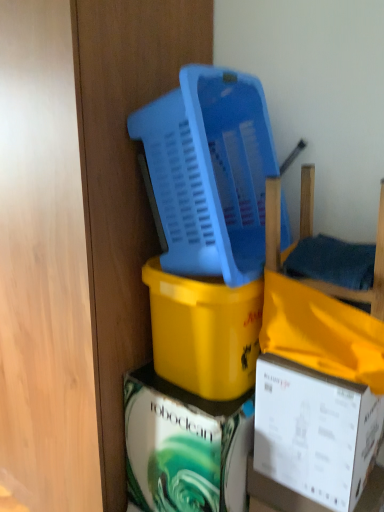
This screenshot has width=384, height=512. What do you see at coordinates (184, 447) in the screenshot?
I see `matte white box at center, positioned as the 3th box in top-to-bottom order` at bounding box center [184, 447].

Locate an element on the screen. This screenshot has width=384, height=512. blue plastic basket at upper center is located at coordinates (210, 172).

This screenshot has width=384, height=512. Identify the location of white cardboard box at lower right, which is the second box from top to bottom. point(315,433).

Is white cardboard box at lower right, which is the second box from top to bottom, surrounding yellow matte plastic bucket at center, which ranks as the first box in top-to-bottom order?

That's incorrect, yellow matte plastic bucket at center, which ranks as the first box in top-to-bottom order, is not inside white cardboard box at lower right, which is the second box from top to bottom.

Is white cardboard box at lower right, which is the second box from top to bottom, bigger or smaller than yellow matte plastic bucket at center, which ranks as the first box in top-to-bottom order?

In the image, white cardboard box at lower right, which is the second box from top to bottom, appears to be smaller than yellow matte plastic bucket at center, which ranks as the first box in top-to-bottom order.

Considering the relative positions of white cardboard box at lower right, which appears as the 2th box when ordered from the bottom, and yellow matte plastic bucket at center, which ranks as the first box in top-to-bottom order, in the image provided, is white cardboard box at lower right, which appears as the 2th box when ordered from the bottom, behind yellow matte plastic bucket at center, which ranks as the first box in top-to-bottom order,?

No, the depth of white cardboard box at lower right, which appears as the 2th box when ordered from the bottom, is less than that of yellow matte plastic bucket at center, which ranks as the first box in top-to-bottom order.

From a real-world perspective, is white cardboard box at lower right, which is the second box from top to bottom, above or below wooden chair at right?

white cardboard box at lower right, which is the second box from top to bottom, is situated lower than wooden chair at right in the real world.

The image size is (384, 512). Find the location of `furniture above the white cardboard box at lower right, which appears as the 2th box when ordered from the bottom (from the image's perspective)`. furniture above the white cardboard box at lower right, which appears as the 2th box when ordered from the bottom (from the image's perspective) is located at coordinates (374, 276).

Considering the relative positions of white cardboard box at lower right, which is the second box from top to bottom, and wooden chair at right in the image provided, is white cardboard box at lower right, which is the second box from top to bottom, to the left of wooden chair at right from the viewer's perspective?

Yes, white cardboard box at lower right, which is the second box from top to bottom, is to the left of wooden chair at right.

Measure the distance between white cardboard box at lower right, which is the second box from top to bottom, and wooden chair at right.

white cardboard box at lower right, which is the second box from top to bottom, and wooden chair at right are 13.93 inches apart.

From a real-world perspective, is white cardboard box at lower right, which appears as the 2th box when ordered from the bottom, located higher than blue plastic basket at upper center?

No.

Is white cardboard box at lower right, which appears as the 2th box when ordered from the bottom, located outside blue plastic basket at upper center?

That's correct, white cardboard box at lower right, which appears as the 2th box when ordered from the bottom, is outside of blue plastic basket at upper center.

Does white cardboard box at lower right, which appears as the 2th box when ordered from the bottom, have a greater width compared to blue plastic basket at upper center?

In fact, white cardboard box at lower right, which appears as the 2th box when ordered from the bottom, might be narrower than blue plastic basket at upper center.

Does point (319, 481) come farther from viewer compared to point (223, 71)?

No, it is in front of (223, 71).

Does wooden chair at right come behind blue plastic basket at upper center?

No.

Is wooden chair at right aimed at blue plastic basket at upper center?

No, wooden chair at right is not oriented towards blue plastic basket at upper center.

From the image's perspective, which is above, wooden chair at right or blue plastic basket at upper center?

blue plastic basket at upper center appears higher in the image.

From a real-world perspective, which object stands above the other?

From a 3D spatial view, blue plastic basket at upper center is above.

Does point (182, 312) come farther from viewer compared to point (380, 201)?

No, it is not.

From the image's perspective, between yellow matte plastic bucket at center, which ranks as the first box in top-to-bottom order, and wooden chair at right, which one is located above?

From the image's view, wooden chair at right is above.

Looking at this image, is yellow matte plastic bucket at center, which is counted as the 3th box, starting from the bottom, taller or shorter than wooden chair at right?

In the image, yellow matte plastic bucket at center, which is counted as the 3th box, starting from the bottom, appears to be taller than wooden chair at right.

Which object is thinner, yellow matte plastic bucket at center, which is counted as the 3th box, starting from the bottom, or wooden chair at right?

wooden chair at right is thinner.

At what (x,y) coordinates should I click in order to perform the action: click on the 2nd box behind the blue plastic basket at upper center, starting your count from the anchor. Please return your answer as a coordinate pair (x, y). Looking at the image, I should click on (204, 332).

Is yellow matte plastic bucket at center, which is counted as the 3th box, starting from the bottom, positioned far away from blue plastic basket at upper center?

No, yellow matte plastic bucket at center, which is counted as the 3th box, starting from the bottom, is in close proximity to blue plastic basket at upper center.

From the image's perspective, which is below, yellow matte plastic bucket at center, which is counted as the 3th box, starting from the bottom, or blue plastic basket at upper center?

yellow matte plastic bucket at center, which is counted as the 3th box, starting from the bottom, is shown below in the image.

Which object is wider, yellow matte plastic bucket at center, which is counted as the 3th box, starting from the bottom, or blue plastic basket at upper center?

blue plastic basket at upper center.

Does matte white box at center, positioned as the 3th box in top-to-bottom order, have a greater width compared to wooden chair at right?

Indeed, matte white box at center, positioned as the 3th box in top-to-bottom order, has a greater width compared to wooden chair at right.

From the image's perspective, is matte white box at center, positioned as the 3th box in top-to-bottom order, above wooden chair at right?

No.

Does matte white box at center, the 1th box when ordered from bottom to top, turn towards wooden chair at right?

No, matte white box at center, the 1th box when ordered from bottom to top, does not turn towards wooden chair at right.

From a real-world perspective, is matte white box at center, the 1th box when ordered from bottom to top, physically located above or below wooden chair at right?

matte white box at center, the 1th box when ordered from bottom to top, is situated lower than wooden chair at right in the real world.

Find the location of a particular element. This screenshot has width=384, height=512. box in front of the yellow matte plastic bucket at center, which is counted as the 3th box, starting from the bottom is located at coordinates (315, 433).

From the wooden chair at right, count 1st boxs backward and point to it. Please provide its 2D coordinates.

[(315, 433)]

Considering their positions, is blue plastic basket at upper center positioned closer to white cardboard box at lower right, which is the second box from top to bottom, than yellow matte plastic bucket at center, which ranks as the first box in top-to-bottom order?

Based on the image, yellow matte plastic bucket at center, which ranks as the first box in top-to-bottom order, appears to be nearer to white cardboard box at lower right, which is the second box from top to bottom.

From the image, which object appears to be nearer to matte white box at center, the 1th box when ordered from bottom to top, yellow matte plastic bucket at center, which is counted as the 3th box, starting from the bottom, or blue plastic basket at upper center?

yellow matte plastic bucket at center, which is counted as the 3th box, starting from the bottom, is positioned closer to the anchor matte white box at center, the 1th box when ordered from bottom to top.

From the image, which object appears to be nearer to matte white box at center, positioned as the 3th box in top-to-bottom order, blue plastic basket at upper center or white cardboard box at lower right, which is the second box from top to bottom?

Based on the image, white cardboard box at lower right, which is the second box from top to bottom, appears to be nearer to matte white box at center, positioned as the 3th box in top-to-bottom order.

Estimate the real-world distances between objects in this image. Which object is further from yellow matte plastic bucket at center, which is counted as the 3th box, starting from the bottom, matte white box at center, the 1th box when ordered from bottom to top, or white cardboard box at lower right, which is the second box from top to bottom?

white cardboard box at lower right, which is the second box from top to bottom, lies further to yellow matte plastic bucket at center, which is counted as the 3th box, starting from the bottom, than the other object.

When comparing their distances from wooden chair at right, does blue plastic basket at upper center or white cardboard box at lower right, which is the second box from top to bottom, seem closer?

blue plastic basket at upper center.

Considering their positions, is yellow matte plastic bucket at center, which is counted as the 3th box, starting from the bottom, positioned further to matte white box at center, the 1th box when ordered from bottom to top, than wooden chair at right?

wooden chair at right is positioned further to the anchor matte white box at center, the 1th box when ordered from bottom to top.

From the image, which object appears to be nearer to matte white box at center, the 1th box when ordered from bottom to top, wooden chair at right or yellow matte plastic bucket at center, which ranks as the first box in top-to-bottom order?

Based on the image, yellow matte plastic bucket at center, which ranks as the first box in top-to-bottom order, appears to be nearer to matte white box at center, the 1th box when ordered from bottom to top.

Estimate the real-world distances between objects in this image. Which object is further from yellow matte plastic bucket at center, which ranks as the first box in top-to-bottom order, white cardboard box at lower right, which appears as the 2th box when ordered from the bottom, or wooden chair at right?

wooden chair at right lies further to yellow matte plastic bucket at center, which ranks as the first box in top-to-bottom order, than the other object.

Locate an element on the screen. This screenshot has height=512, width=384. box between blue plastic basket at upper center and white cardboard box at lower right, which appears as the 2th box when ordered from the bottom, in the up-down direction is located at coordinates (204, 332).

You are a GUI agent. You are given a task and a screenshot of the screen. Output one action in this format:
    pyautogui.click(x=<x>, y=<y>)
    Task: Click on the box between wooden chair at right and white cardboard box at lower right, which appears as the 2th box when ordered from the bottom, in the up-down direction
    The height and width of the screenshot is (512, 384).
    Given the screenshot: What is the action you would take?
    pyautogui.click(x=204, y=332)

In order to click on box that lies between yellow matte plastic bucket at center, which ranks as the first box in top-to-bottom order, and matte white box at center, the 1th box when ordered from bottom to top, from top to bottom in this screenshot , I will do `click(315, 433)`.

Image resolution: width=384 pixels, height=512 pixels. Identify the location of furniture that lies between blue plastic basket at upper center and white cardboard box at lower right, which is the second box from top to bottom, from top to bottom. (374, 276).